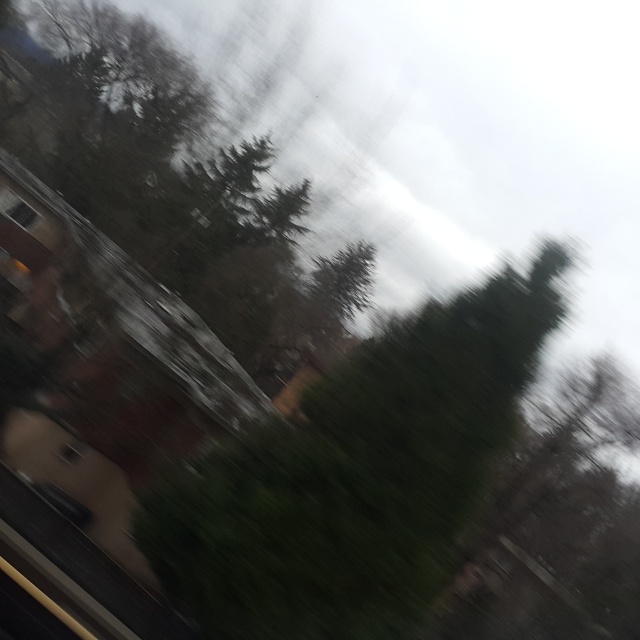
You are a passenger in a car and see the green leafy tree at center and the transparent glass window at upper left through the motion blurred window. Which object appears bigger in the scene?

The green leafy tree at center appears bigger than the transparent glass window at upper left because it has a larger size compared to it.

You are a passenger in a moving car and see the green leafy tree at center through the window. If you want to describe its exact location in the image, what coordinates would you use?

The green leafy tree at center is located at coordinates point (356, 474).

You are a drone operator trying to capture a photo of the transparent glass window at upper left and the green leafy tree at center from a distance. The drone has a maximum range of 10 meters. Can the drone successfully take the photo from its current position?

The distance between the green leafy tree at center and the transparent glass window at upper left is 12.15 meters, which exceeds the drone operator drone maximum range of 10 meters. Therefore, the drone cannot successfully take the photo from its current position.